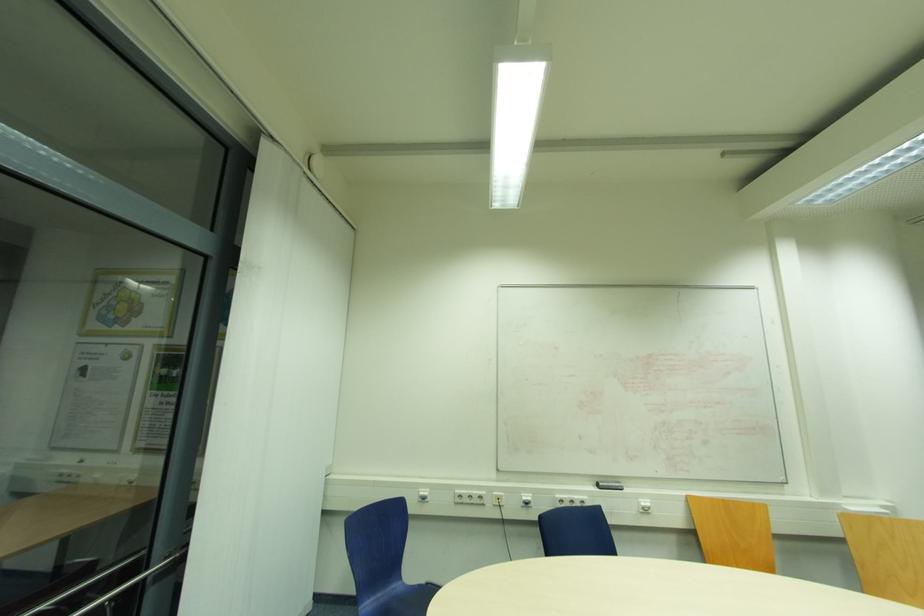
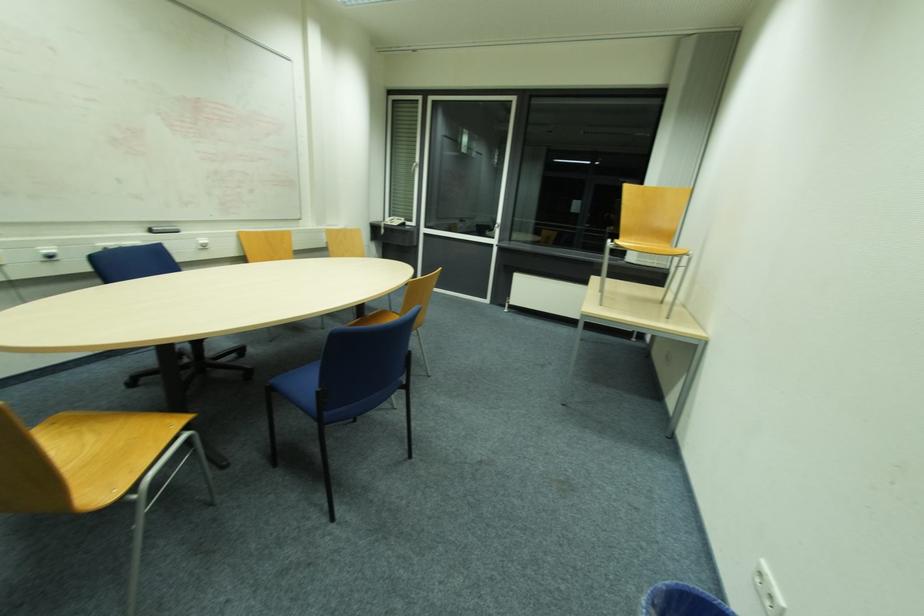
Where in the second image is the point corresponding to pixel 599 480 from the first image?

(151, 227)